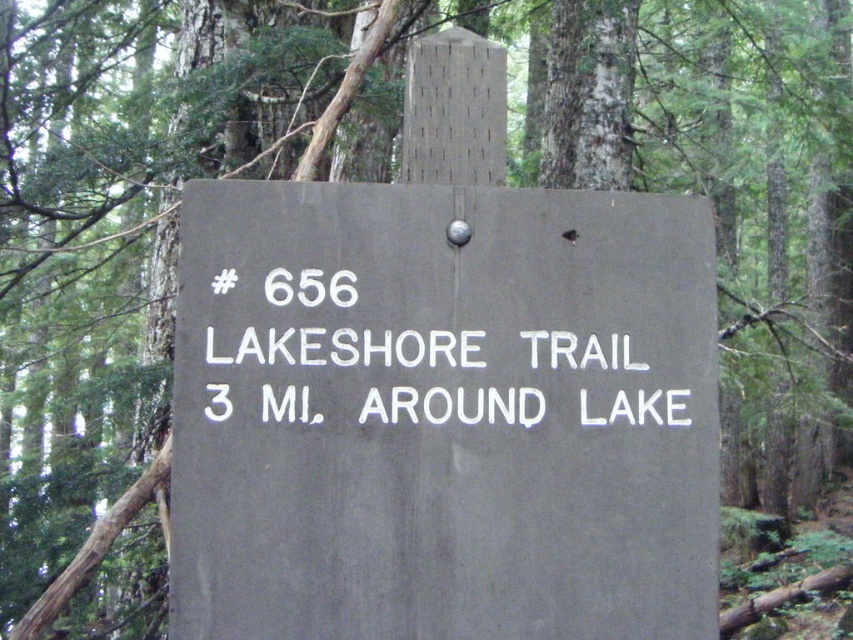
Can you confirm if gray matte sign at center is smaller than white painted text at center?

No.

Does gray matte sign at center appear on the left side of white painted text at center?

Correct, you'll find gray matte sign at center to the left of white painted text at center.

You are a GUI agent. You are given a task and a screenshot of the screen. Output one action in this format:
    pyautogui.click(x=<x>, y=<y>)
    Task: Click on the gray matte sign at center
    Image resolution: width=853 pixels, height=640 pixels.
    Given the screenshot: What is the action you would take?
    pyautogui.click(x=444, y=413)